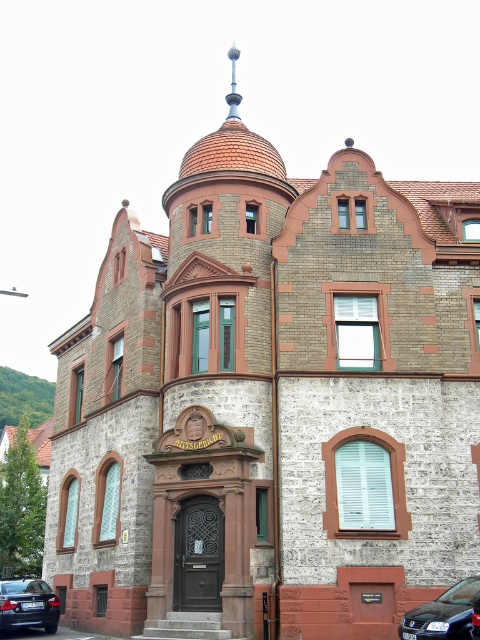
You are standing at the base of the multi story building and see the black glossy car at lower right. You want to throw a ball to hit the car. If you can throw a ball 30 meters, will you be able to reach the car?

The black glossy car at lower right is 30.82 meters away from the viewer. Since the throwing distance is 30 meters, the ball will not reach the car.

You are standing in front of the building and looking at it. There are two points marked on the building facade. The first point is at coordinates point (410, 628) and the second is at point (19, 596). Which point is closer to you?

The point (410, 628) is closer to the camera than point (19, 596).